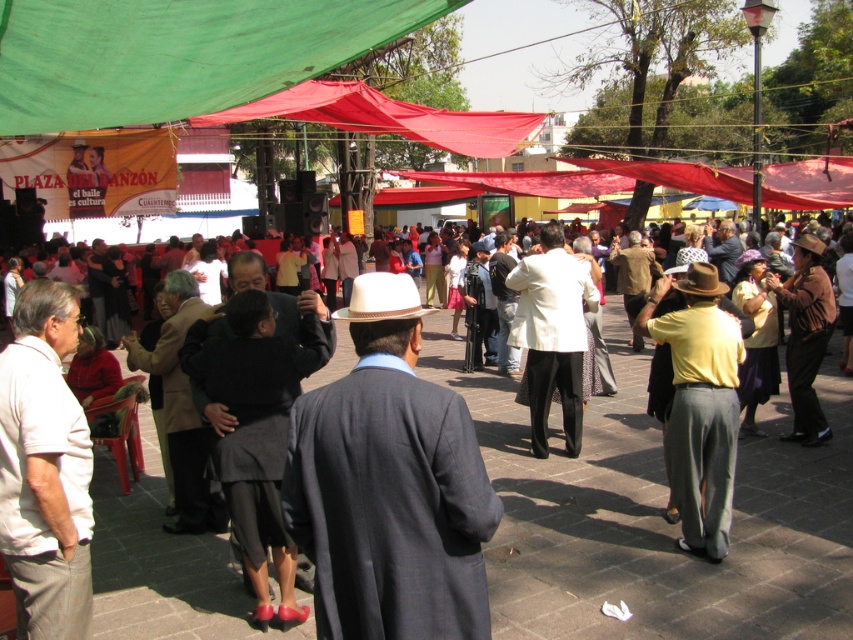
Question: Does matte black suit at center have a lesser width compared to green fabric canopy at upper left?

Choices:
 (A) yes
 (B) no

Answer: (B)

Question: Which object is closer to the camera taking this photo?

Choices:
 (A) white matte suit at center
 (B) matte black suit at center

Answer: (B)

Question: Does green fabric canopy at upper left come in front of white matte suit at center?

Choices:
 (A) yes
 (B) no

Answer: (A)

Question: Which object is positioned farthest from the matte black suit at center?

Choices:
 (A) white matte suit at center
 (B) green fabric canopy at upper left

Answer: (B)

Question: Where is matte black suit at center located in relation to white matte suit at center in the image?

Choices:
 (A) right
 (B) left

Answer: (B)

Question: Based on their relative distances, which object is farther from the matte black suit at center?

Choices:
 (A) green fabric canopy at upper left
 (B) white matte suit at center

Answer: (A)